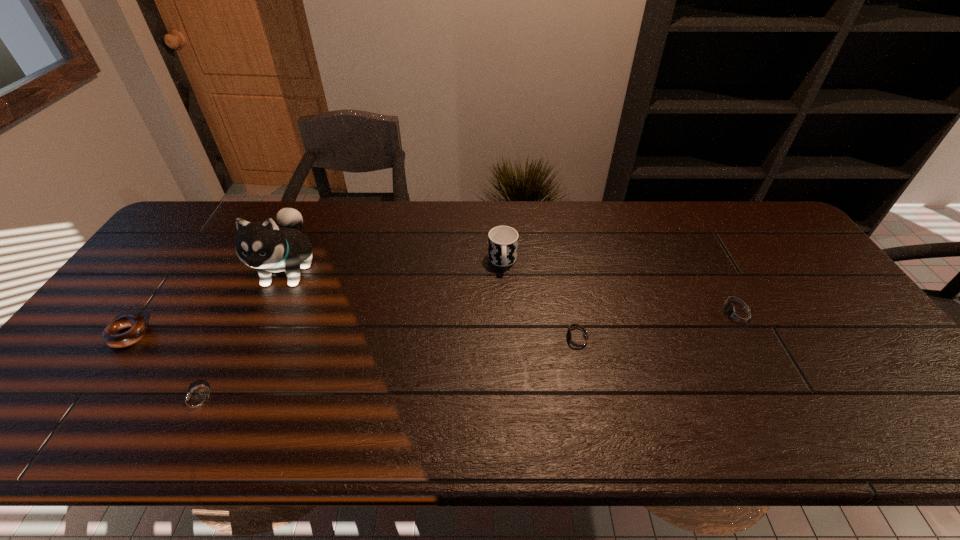
Choose which object is the third nearest neighbor to the tallest object. Please provide its 2D coordinates. Your answer should be formatted as a tuple, i.e. [(x, y)], where the tuple contains the x and y coordinates of a point satisfying the conditions above.

[(502, 240)]

Select which watch is the second closest to the rightmost watch. Please provide its 2D coordinates. Your answer should be formatted as a tuple, i.e. [(x, y)], where the tuple contains the x and y coordinates of a point satisfying the conditions above.

[(196, 401)]

Where is `watch that is the third closest one to the leftmost object`? This screenshot has height=540, width=960. watch that is the third closest one to the leftmost object is located at coordinates (738, 315).

The width and height of the screenshot is (960, 540). In order to click on free space that satisfies the following two spatial constraints: 1. at the face of the tallest object; 2. on the face of the shortest watch in this screenshot , I will do `click(227, 400)`.

You are a GUI agent. You are given a task and a screenshot of the screen. Output one action in this format:
    pyautogui.click(x=<x>, y=<y>)
    Task: Click on the vacant space that satisfies the following two spatial constraints: 1. at the face of the puppy; 2. on the face of the nearest watch
    
    Given the screenshot: What is the action you would take?
    pyautogui.click(x=227, y=400)